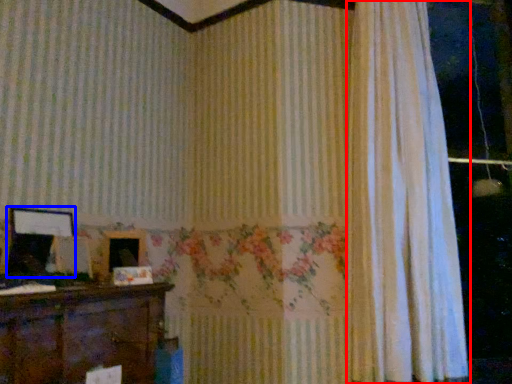
Question: Among these objects, which one is nearest to the camera, curtain (highlighted by a red box) or picture frame (highlighted by a blue box)?

Choices:
 (A) curtain
 (B) picture frame

Answer: (B)